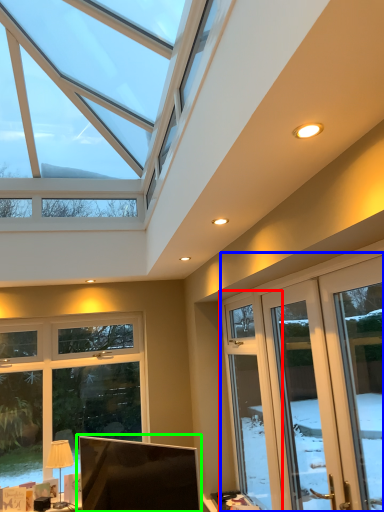
Question: Based on their relative distances, which object is farther from window (highlighted by a red box)? Choose from screen door (highlighted by a blue box) and computer monitor (highlighted by a green box).

Choices:
 (A) screen door
 (B) computer monitor

Answer: (B)